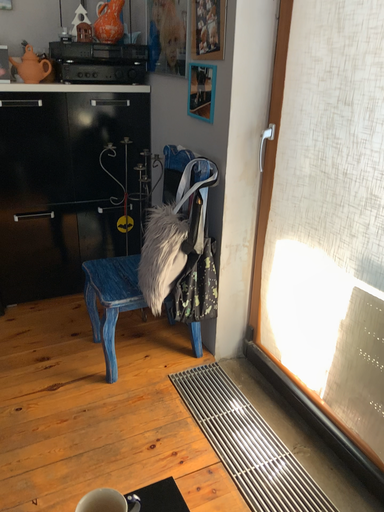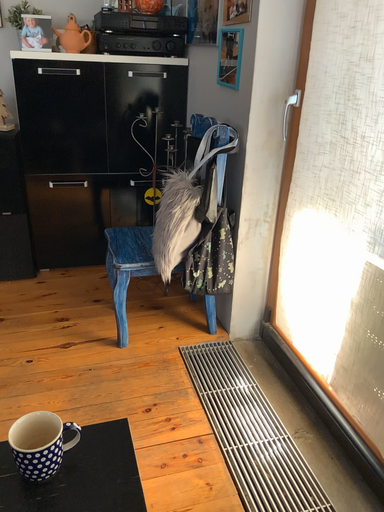
Question: Which way did the camera rotate in the video?

Choices:
 (A) rotated left
 (B) rotated right

Answer: (A)